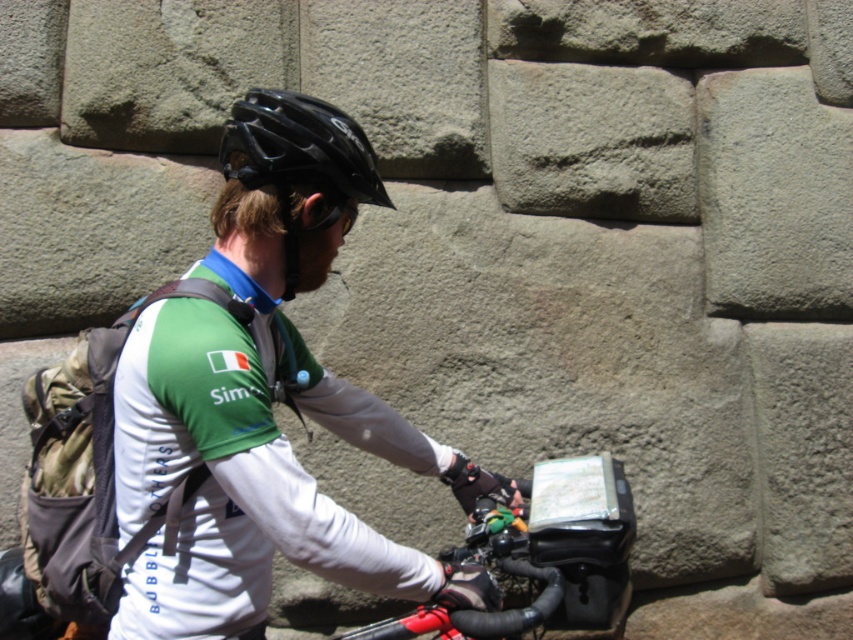
Question: Is matte black helmet at upper center behind black matte helmet at upper center?

Choices:
 (A) yes
 (B) no

Answer: (B)

Question: Which object appears closest to the camera in this image?

Choices:
 (A) gray rough stone at upper center
 (B) black matte helmet at upper center

Answer: (B)

Question: Does matte black helmet at upper center have a larger size compared to gray rough stone at upper center?

Choices:
 (A) yes
 (B) no

Answer: (A)

Question: Which point is closer to the camera taking this photo?

Choices:
 (A) (277, 305)
 (B) (610, 108)
 (C) (262, 154)

Answer: (C)

Question: Which point is closer to the camera taking this photo?

Choices:
 (A) (622, 116)
 (B) (263, 125)
 (C) (368, 536)

Answer: (C)

Question: Is matte black helmet at upper center below black matte helmet at upper center?

Choices:
 (A) yes
 (B) no

Answer: (A)